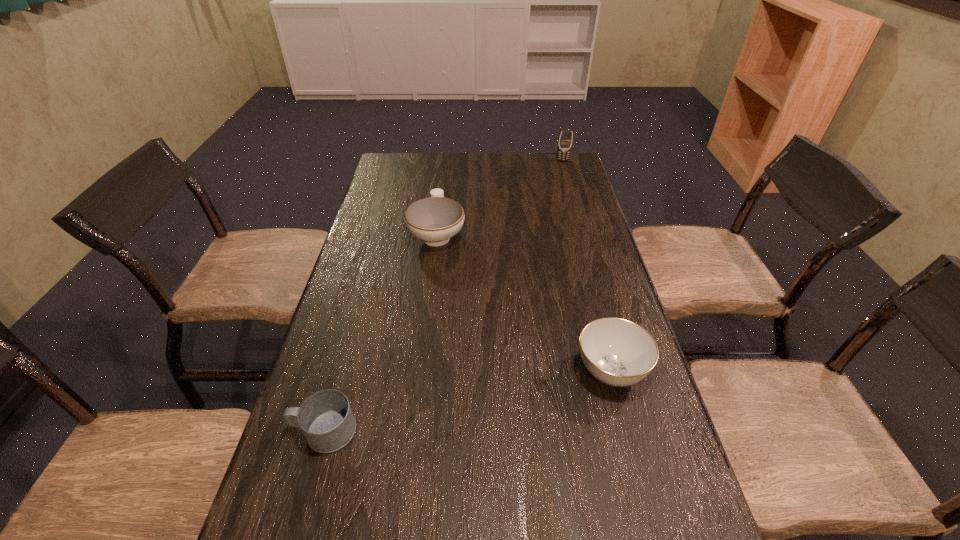
Identify the location of free spot located on the side with the handle of the third nearest object. (444, 182).

This screenshot has width=960, height=540. In order to click on vacant space situated on the side with the handle of the third nearest object in this screenshot , I will do `click(441, 202)`.

Locate an element on the screen. free point located 0.140m on the left of the nearer chinaware is located at coordinates (514, 371).

Where is `object at the far edge`? object at the far edge is located at coordinates (565, 139).

The height and width of the screenshot is (540, 960). I want to click on chinaware situated at the left edge, so click(435, 219).

The width and height of the screenshot is (960, 540). In order to click on mug located in the left edge section of the desktop in this screenshot , I will do `click(326, 419)`.

At what (x,y) coordinates should I click in order to perform the action: click on cellular telephone located at the right edge. Please return your answer as a coordinate pair (x, y). The image size is (960, 540). Looking at the image, I should click on (565, 139).

Image resolution: width=960 pixels, height=540 pixels. I want to click on chinaware that is at the right edge, so click(x=617, y=352).

Where is `object that is positioned at the far right corner`? The height and width of the screenshot is (540, 960). object that is positioned at the far right corner is located at coordinates (565, 139).

At what (x,y) coordinates should I click in order to perform the action: click on free region at the far edge of the desktop. Please return your answer as a coordinate pair (x, y). Image resolution: width=960 pixels, height=540 pixels. Looking at the image, I should click on (509, 152).